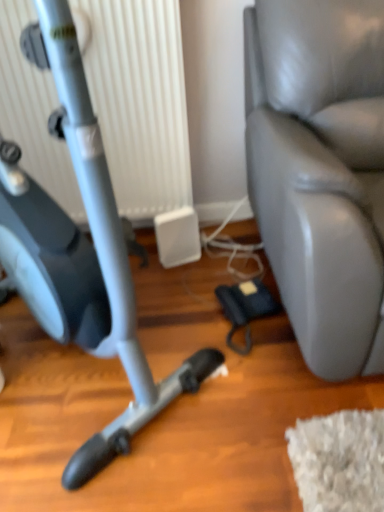
Question: Is leather swivel chair at right at the right side of matte gray stationary bicycle at left?

Choices:
 (A) yes
 (B) no

Answer: (A)

Question: Is leather swivel chair at right facing towards matte gray stationary bicycle at left?

Choices:
 (A) no
 (B) yes

Answer: (A)

Question: Is leather swivel chair at right taller than matte gray stationary bicycle at left?

Choices:
 (A) no
 (B) yes

Answer: (A)

Question: Would you say leather swivel chair at right is a long distance from matte gray stationary bicycle at left?

Choices:
 (A) yes
 (B) no

Answer: (B)

Question: Does leather swivel chair at right lie in front of matte gray stationary bicycle at left?

Choices:
 (A) yes
 (B) no

Answer: (B)

Question: Is leather swivel chair at right shorter than matte gray stationary bicycle at left?

Choices:
 (A) no
 (B) yes

Answer: (B)

Question: Can you confirm if matte gray stationary bicycle at left is thinner than leather swivel chair at right?

Choices:
 (A) no
 (B) yes

Answer: (B)

Question: Does matte gray stationary bicycle at left have a lesser height compared to leather swivel chair at right?

Choices:
 (A) yes
 (B) no

Answer: (B)

Question: Considering the relative sizes of matte gray stationary bicycle at left and leather swivel chair at right in the image provided, is matte gray stationary bicycle at left smaller than leather swivel chair at right?

Choices:
 (A) no
 (B) yes

Answer: (B)

Question: Does matte gray stationary bicycle at left lie behind leather swivel chair at right?

Choices:
 (A) no
 (B) yes

Answer: (A)

Question: From the image's perspective, is matte gray stationary bicycle at left above leather swivel chair at right?

Choices:
 (A) no
 (B) yes

Answer: (A)

Question: Does matte gray stationary bicycle at left contain leather swivel chair at right?

Choices:
 (A) yes
 (B) no

Answer: (B)

Question: Is matte gray stationary bicycle at left positioned with its back to white plastic radiator at upper left?

Choices:
 (A) yes
 (B) no

Answer: (B)